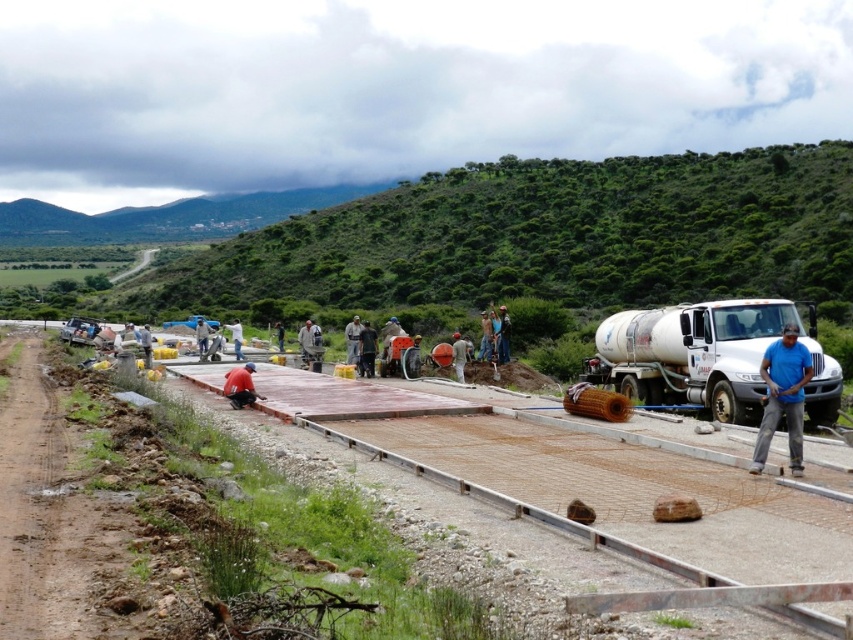
Question: Is white metallic tanker truck at right below blue shirt at center?

Choices:
 (A) yes
 (B) no

Answer: (A)

Question: Can you confirm if smooth concrete slab at center is smaller than blue shirt at center?

Choices:
 (A) no
 (B) yes

Answer: (B)

Question: In this image, where is smooth concrete slab at center located relative to white metallic tanker truck at right?

Choices:
 (A) right
 (B) left

Answer: (B)

Question: Considering the real-world distances, which object is closest to the smooth concrete slab at center?

Choices:
 (A) white metallic tanker truck at right
 (B) blue shirt at center

Answer: (A)

Question: Estimate the real-world distances between objects in this image. Which object is closer to the smooth concrete slab at center?

Choices:
 (A) blue fabric construction worker at center
 (B) blue shirt at center

Answer: (A)

Question: Which point appears closest to the camera in this image?

Choices:
 (A) (631, 372)
 (B) (230, 332)
 (C) (798, 451)
 (D) (607, 497)

Answer: (D)